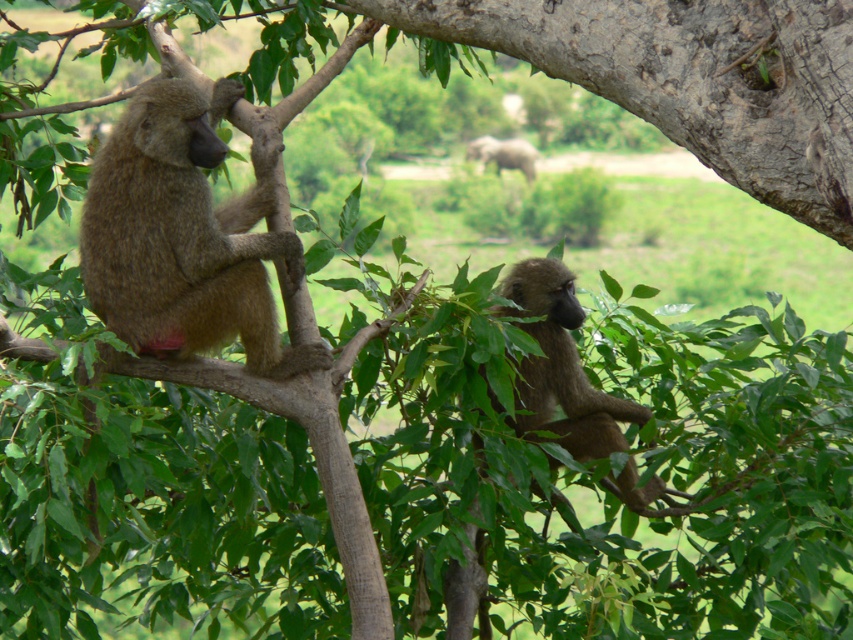
You are a wildlife photographer aiming to capture both the brown furry monkey at left and the brown furry monkey at center in a single frame. Based on their sizes in the image, which monkey would appear larger in your photo?

The brown furry monkey at left would appear larger in the photo because its width is larger than the brown furry monkey at center.